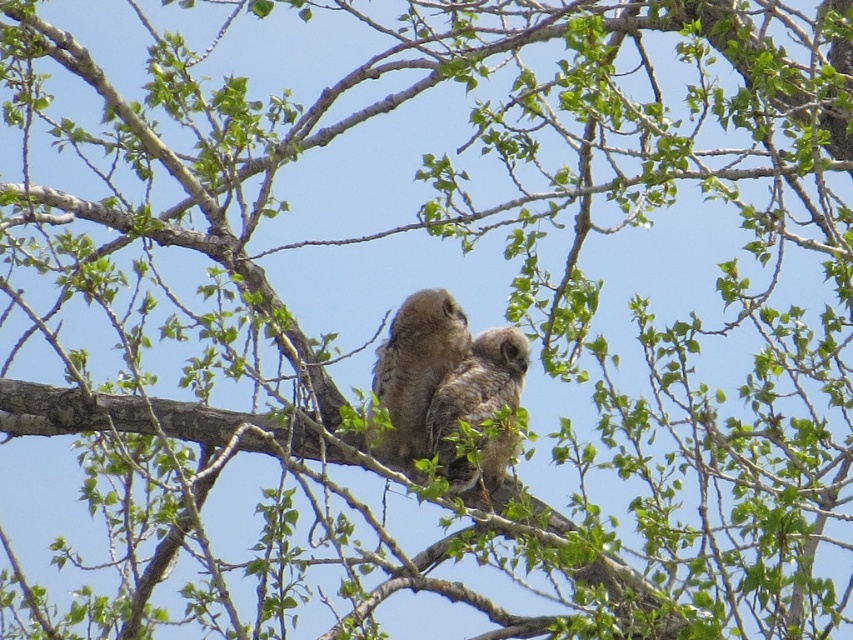
Who is positioned more to the left, brown fuzzy owl at center or brown fluffy owl at center?

brown fuzzy owl at center

Which is more to the right, brown fuzzy owl at center or brown fluffy owl at center?

From the viewer's perspective, brown fluffy owl at center appears more on the right side.

Is point (424, 348) closer to camera compared to point (474, 424)?

No, (424, 348) is behind (474, 424).

Locate an element on the screen. This screenshot has height=640, width=853. brown fuzzy owl at center is located at coordinates (415, 369).